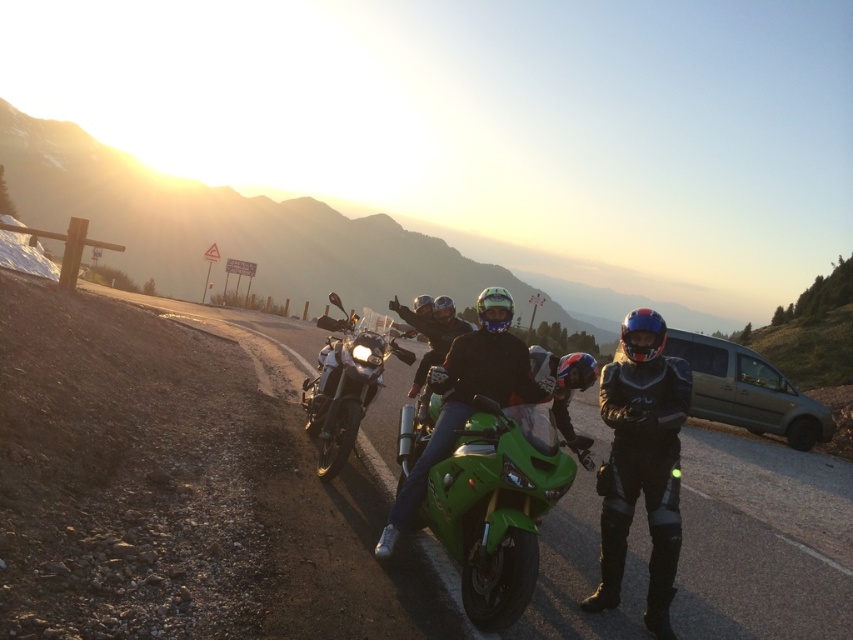
Question: Which of the following is the closest to the observer?

Choices:
 (A) [320, 467]
 (B) [611, 380]

Answer: (B)

Question: From the image, what is the correct spatial relationship of green glossy motorcycle at center in relation to shiny chrome motorcycle at center?

Choices:
 (A) below
 (B) above

Answer: (A)

Question: Is black leather jacket at center positioned in front of shiny chrome motorcycle at center?

Choices:
 (A) yes
 (B) no

Answer: (A)

Question: Considering the real-world distances, which object is closest to the black leather jacket at center?

Choices:
 (A) green glossy motorcycle at center
 (B) shiny chrome motorcycle at center
 (C) green matte motorcycle at center

Answer: (C)

Question: Is the position of black leather jacket at center less distant than that of green glossy motorcycle at center?

Choices:
 (A) no
 (B) yes

Answer: (B)

Question: Estimate the real-world distances between objects in this image. Which object is farther from the black leather jacket at center?

Choices:
 (A) green matte motorcycle at center
 (B) green glossy motorcycle at center
 (C) shiny chrome motorcycle at center

Answer: (C)